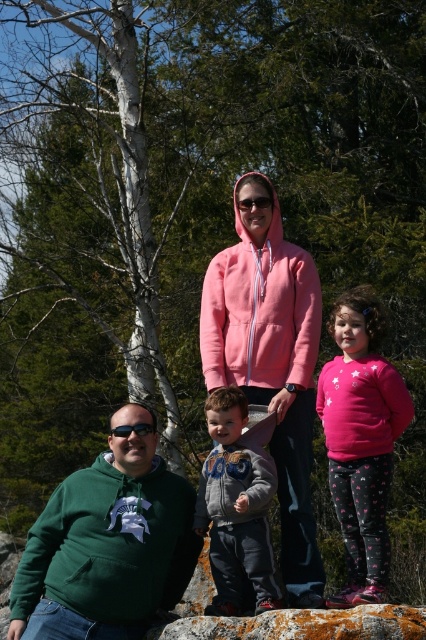
Question: Based on their relative distances, which object is farther from the rusty rock at center?

Choices:
 (A) pink fleece at center
 (B) green fleece sweatshirt at center
 (C) pink fleece hoodie at center
 (D) pink fleece sweatshirt at center

Answer: (D)

Question: Can you confirm if pink fleece sweatshirt at center is bigger than rusty rock at center?

Choices:
 (A) yes
 (B) no

Answer: (A)

Question: Where is green fleece sweatshirt at center located in relation to green matte sunglasses at lower left in the image?

Choices:
 (A) left
 (B) right

Answer: (A)

Question: Which point appears closest to the camera in this image?

Choices:
 (A) (111, 433)
 (B) (131, 614)
 (C) (299, 346)

Answer: (B)

Question: Estimate the real-world distances between objects in this image. Which object is closer to the pink fleece hoodie at center?

Choices:
 (A) pink fleece sweatshirt at center
 (B) green matte sunglasses at lower left
 (C) rusty rock at center
 (D) olive-green fleece jacket at center

Answer: (A)

Question: Can you confirm if green fleece sweatshirt at center is positioned to the right of pink fleece hoodie at center?

Choices:
 (A) yes
 (B) no

Answer: (B)